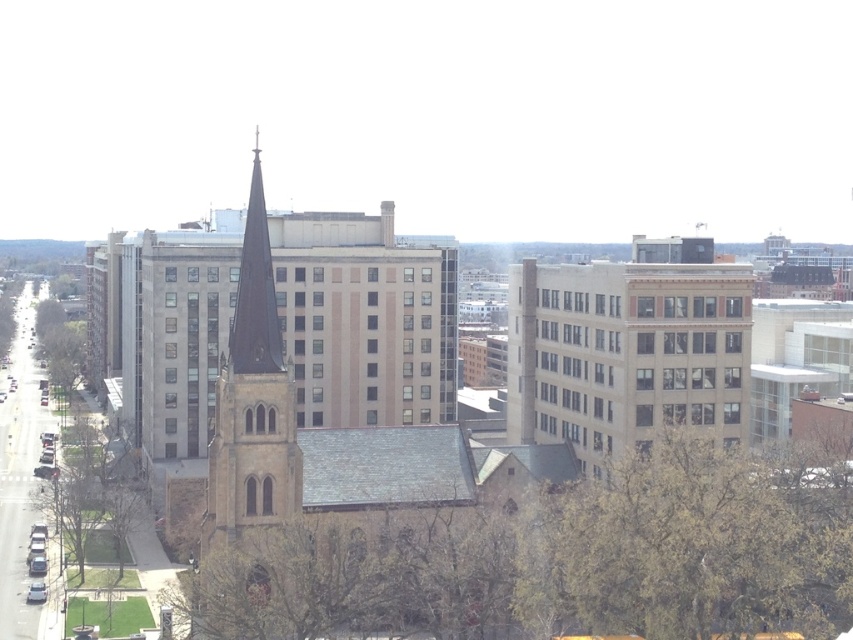
Question: Can you confirm if brown stone church at center is positioned to the right of green leafy tree at lower left?

Choices:
 (A) yes
 (B) no

Answer: (B)

Question: Does brown stone church at center have a lesser width compared to green leafy tree at left?

Choices:
 (A) no
 (B) yes

Answer: (A)

Question: Estimate the real-world distances between objects in this image. Which object is closer to the green leafy tree at lower left?

Choices:
 (A) brown stone church at center
 (B) green leafy tree at left

Answer: (A)

Question: Which object is closer to the camera taking this photo?

Choices:
 (A) brown stone church at center
 (B) green leafy tree at left

Answer: (A)

Question: Can you confirm if brown stone church at center is positioned to the right of green leafy tree at left?

Choices:
 (A) no
 (B) yes

Answer: (B)

Question: Considering the real-world distances, which object is farthest from the green leafy tree at left?

Choices:
 (A) brown stone church at center
 (B) green leafy tree at lower left

Answer: (B)